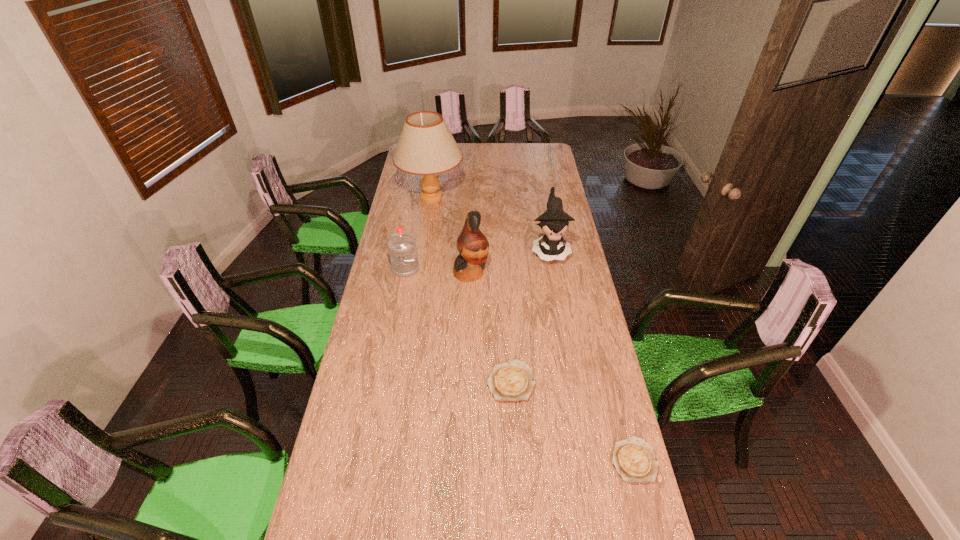
Where is `the left quiche`? the left quiche is located at coordinates (512, 381).

In order to click on the fifth tallest object in this screenshot , I will do `click(512, 381)`.

Identify the location of the nearest object. [634, 459].

You are a GUI agent. You are given a task and a screenshot of the screen. Output one action in this format:
    pyautogui.click(x=<x>, y=<y>)
    Task: Click on the shortest object
    The image size is (960, 540).
    Given the screenshot: What is the action you would take?
    pyautogui.click(x=634, y=459)

Identify the location of the tallest object. The width and height of the screenshot is (960, 540). pyautogui.click(x=426, y=146).

The height and width of the screenshot is (540, 960). What are the coordinates of `the farthest object` in the screenshot? It's located at (426, 146).

This screenshot has height=540, width=960. In order to click on water bottle in this screenshot , I will do `click(402, 250)`.

At what (x,y) coordinates should I click in order to perform the action: click on parrot. Please return your answer as a coordinate pair (x, y). Image resolution: width=960 pixels, height=540 pixels. Looking at the image, I should click on tap(473, 246).

Find the location of a particular element. Image resolution: width=960 pixels, height=540 pixels. doll is located at coordinates (555, 221).

This screenshot has width=960, height=540. In order to click on free space located 0.400m on the left of the left quiche in this screenshot , I will do `click(372, 381)`.